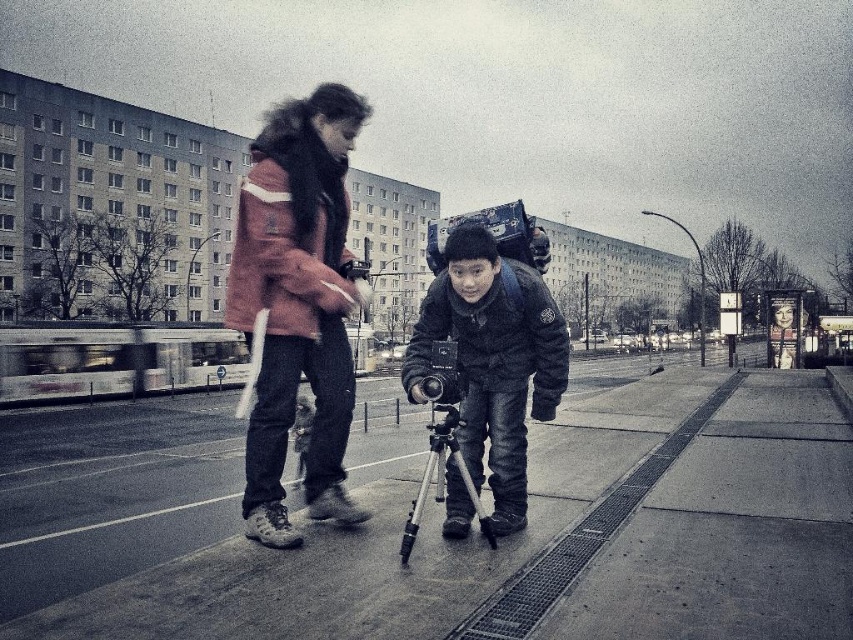
Who is positioned more to the right, matte black camera at center or silver metallic tripod at center?

matte black camera at center is more to the right.

Is point (479, 484) behind point (467, 483)?

Yes, point (479, 484) is farther from viewer.

The height and width of the screenshot is (640, 853). I want to click on matte black camera at center, so click(492, 358).

In the scene shown: Who is more forward, (x=281, y=246) or (x=502, y=396)?

Point (x=281, y=246) is in front.

Between matte pink jacket at center and matte black camera at center, which one has more height?

matte pink jacket at center

Does point (346, 252) come closer to viewer compared to point (495, 449)?

Yes, it is.

At what (x,y) coordinates should I click in order to perform the action: click on matte pink jacket at center. Please return your answer as a coordinate pair (x, y). The height and width of the screenshot is (640, 853). Looking at the image, I should click on [x=297, y=304].

You are a GUI agent. You are given a task and a screenshot of the screen. Output one action in this format:
    pyautogui.click(x=<x>, y=<y>)
    Task: Click on the smooth concrete pavement at center
    
    Given the screenshot: What is the action you would take?
    pyautogui.click(x=555, y=538)